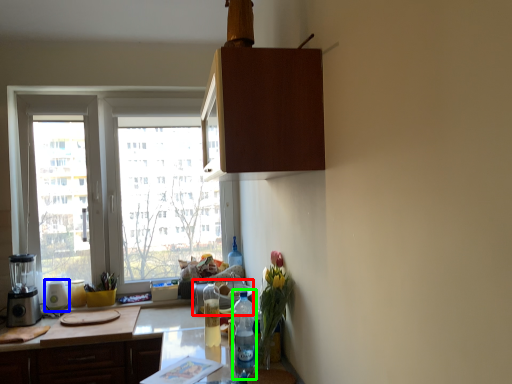
Question: Estimate the real-world distances between objects in this image. Which object is farther from appliance (highlighted by a red box), appliance (highlighted by a blue box) or bottle (highlighted by a green box)?

Choices:
 (A) appliance
 (B) bottle

Answer: (A)